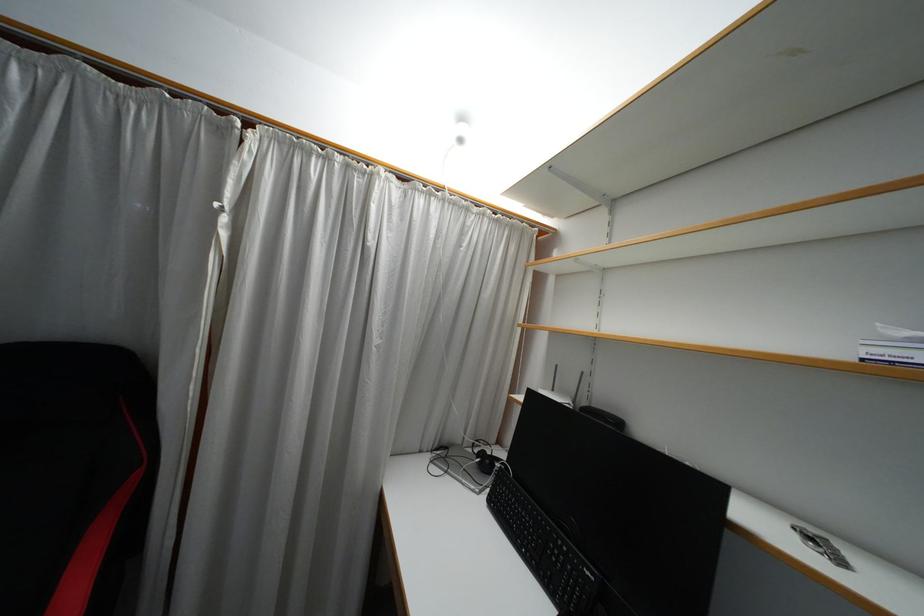
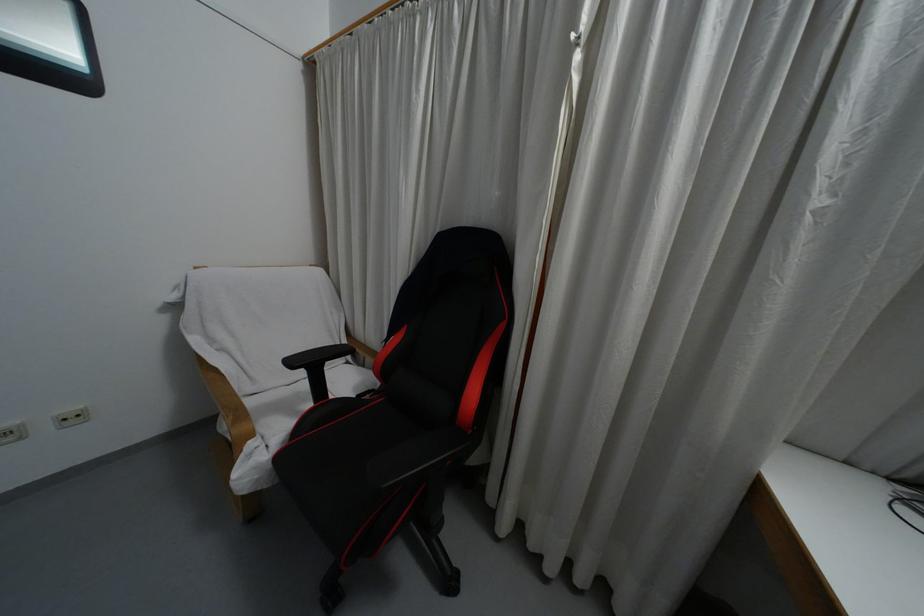
Question: The camera is either moving clockwise (left) or counter-clockwise (right) around the object. The first image is from the beginning of the video and the second image is from the end. Is the camera moving left or right when shooting the video?

Choices:
 (A) Left
 (B) Right

Answer: (B)